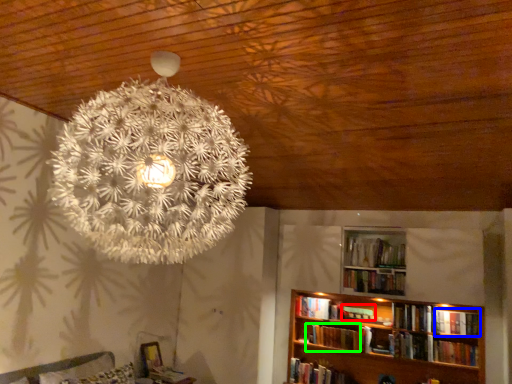
Question: Estimate the real-world distances between objects in this image. Which object is closer to book (highlighted by a red box), book (highlighted by a blue box) or book (highlighted by a green box)?

Choices:
 (A) book
 (B) book

Answer: (B)